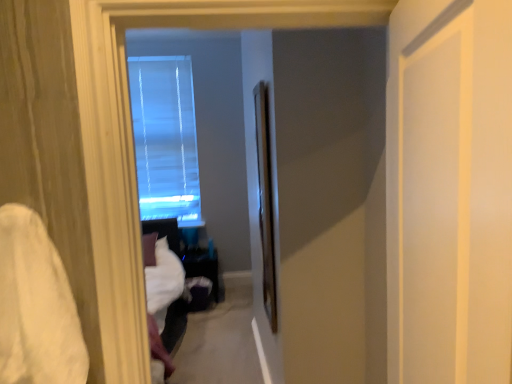
Question: In which direction should I rotate to look at clear glass screen door at center, acting as the 2th screen door starting from the right?

Choices:
 (A) right
 (B) left

Answer: (A)

Question: Is white matte door at right, positioned as the 2th screen door in left-to-right order, completely or partially outside of clear glass screen door at center, the first screen door positioned from the back?

Choices:
 (A) no
 (B) yes

Answer: (B)

Question: Considering the relative positions of white matte door at right, positioned as the 2th screen door in left-to-right order, and clear glass screen door at center, the first screen door positioned from the back, in the image provided, is white matte door at right, positioned as the 2th screen door in left-to-right order, to the left of clear glass screen door at center, the first screen door positioned from the back, from the viewer's perspective?

Choices:
 (A) no
 (B) yes

Answer: (A)

Question: Would you say clear glass screen door at center, the first screen door positioned from the back, is part of white matte door at right, the first screen door from the front,'s contents?

Choices:
 (A) no
 (B) yes

Answer: (A)

Question: From a real-world perspective, is white matte door at right, placed as the 1th screen door when sorted from right to left, over clear glass screen door at center, acting as the 2th screen door starting from the right?

Choices:
 (A) yes
 (B) no

Answer: (A)

Question: Is white matte door at right, the first screen door from the front, turned away from clear glass screen door at center, acting as the 2th screen door starting from the right?

Choices:
 (A) yes
 (B) no

Answer: (B)

Question: Are white matte door at right, positioned as the 2th screen door in left-to-right order, and clear glass screen door at center, acting as the 2th screen door starting from the right, located far from each other?

Choices:
 (A) no
 (B) yes

Answer: (B)

Question: Is transparent glass window at center not within white matte door at right, the first screen door from the front?

Choices:
 (A) yes
 (B) no

Answer: (A)

Question: Is white matte door at right, placed as the 1th screen door when sorted from right to left, surrounded by transparent glass window at center?

Choices:
 (A) no
 (B) yes

Answer: (A)

Question: Is transparent glass window at center far away from white matte door at right, the first screen door from the front?

Choices:
 (A) no
 (B) yes

Answer: (B)

Question: Is transparent glass window at center to the left of white matte door at right, positioned as the 2th screen door in left-to-right order, from the viewer's perspective?

Choices:
 (A) yes
 (B) no

Answer: (A)

Question: From the image's perspective, is transparent glass window at center above white matte door at right, positioned as the second screen door in back-to-front order?

Choices:
 (A) yes
 (B) no

Answer: (A)

Question: Considering the relative sizes of transparent glass window at center and white matte door at right, positioned as the 2th screen door in left-to-right order, in the image provided, is transparent glass window at center taller than white matte door at right, positioned as the 2th screen door in left-to-right order,?

Choices:
 (A) yes
 (B) no

Answer: (A)

Question: From a real-world perspective, does clear glass screen door at center, the first screen door positioned from the back, stand above white soft fabric at left?

Choices:
 (A) yes
 (B) no

Answer: (A)